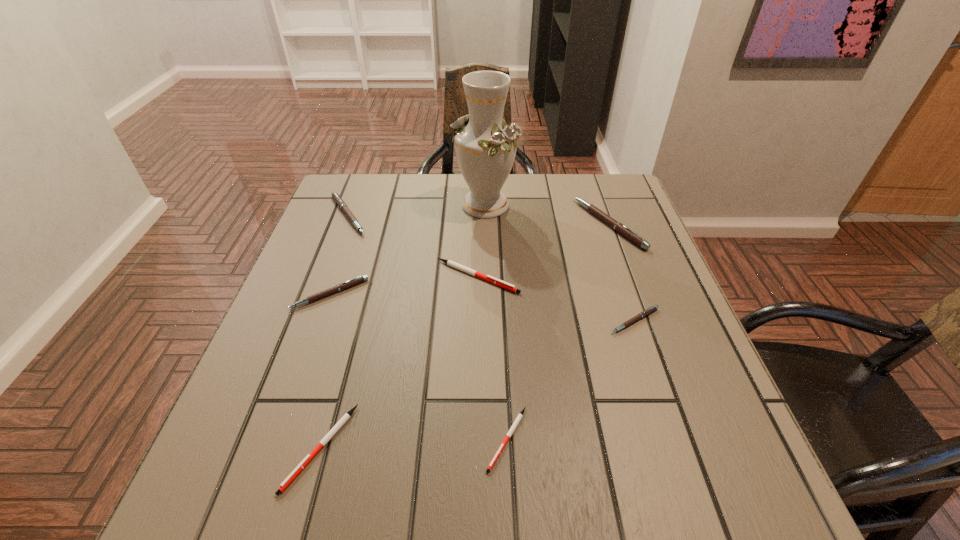
Identify the location of vase. This screenshot has height=540, width=960. (485, 146).

At what (x,y) coordinates should I click in order to perform the action: click on the tallest pen. Please return your answer as a coordinate pair (x, y). The height and width of the screenshot is (540, 960). Looking at the image, I should click on (617, 226).

Identify the location of the second tallest object. (617, 226).

At what (x,y) coordinates should I click in order to perform the action: click on the second biggest pink pen. Please return your answer as a coordinate pair (x, y). The image size is (960, 540). Looking at the image, I should click on (336, 197).

Locate an element on the screen. the sixth shortest pen is located at coordinates (336, 197).

In order to click on the second smallest pink pen in this screenshot , I will do `click(360, 279)`.

The image size is (960, 540). Identify the location of the farthest white pen. (470, 271).

What are the coordinates of `the smallest pink pen` in the screenshot? It's located at (646, 312).

The width and height of the screenshot is (960, 540). What are the coordinates of `the leftmost white pen` in the screenshot? It's located at (342, 421).

Locate an element on the screen. The width and height of the screenshot is (960, 540). the smallest white pen is located at coordinates (520, 415).